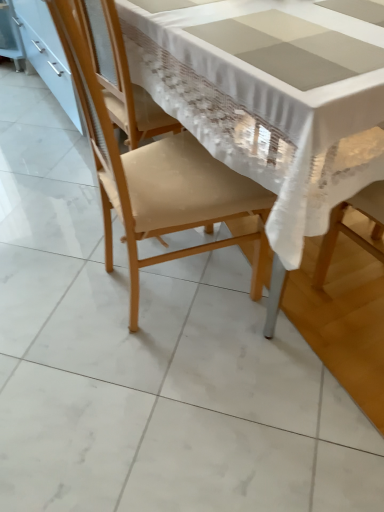
Question: Is point (342, 173) closer or farther from the camera than point (24, 6)?

Choices:
 (A) closer
 (B) farther

Answer: (A)

Question: From a real-world perspective, relative to white glossy cabinet at left, is white lace tablecloth at center vertically above or below?

Choices:
 (A) below
 (B) above

Answer: (B)

Question: Which of these objects is positioned farthest from the matte beige chair at center?

Choices:
 (A) white glossy cabinet at left
 (B) white lace tablecloth at center

Answer: (A)

Question: Estimate the real-world distances between objects in this image. Which object is closer to the white glossy cabinet at left?

Choices:
 (A) white lace tablecloth at center
 (B) matte beige chair at center

Answer: (B)